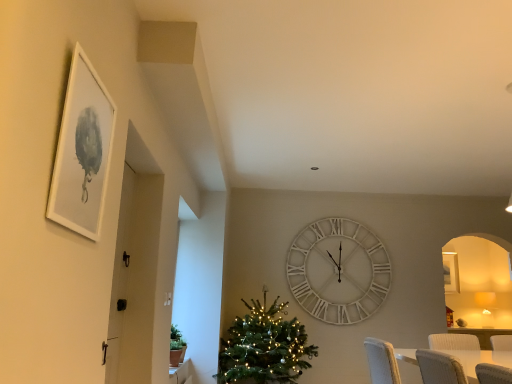
Question: Is green matte christmas tree at center facing away from white matte picture frame at upper left?

Choices:
 (A) yes
 (B) no

Answer: (B)

Question: Is green matte christmas tree at center taller than white matte picture frame at upper left?

Choices:
 (A) yes
 (B) no

Answer: (A)

Question: From a real-world perspective, is green matte christmas tree at center located beneath white matte picture frame at upper left?

Choices:
 (A) no
 (B) yes

Answer: (B)

Question: From a real-world perspective, does green matte christmas tree at center stand above white matte picture frame at upper left?

Choices:
 (A) yes
 (B) no

Answer: (B)

Question: Can we say green matte christmas tree at center lies outside white matte picture frame at upper left?

Choices:
 (A) no
 (B) yes

Answer: (B)

Question: From the image's perspective, is green matte christmas tree at center under white matte picture frame at upper left?

Choices:
 (A) no
 (B) yes

Answer: (B)

Question: Is white matte picture frame at upper left closer to camera compared to white wooden clock at center?

Choices:
 (A) yes
 (B) no

Answer: (A)

Question: Considering the relative sizes of white matte picture frame at upper left and white wooden clock at center in the image provided, is white matte picture frame at upper left wider than white wooden clock at center?

Choices:
 (A) no
 (B) yes

Answer: (A)

Question: Is white matte picture frame at upper left in contact with white wooden clock at center?

Choices:
 (A) no
 (B) yes

Answer: (A)

Question: Is white matte picture frame at upper left outside white wooden clock at center?

Choices:
 (A) no
 (B) yes

Answer: (B)

Question: Is there a large distance between white matte picture frame at upper left and white wooden clock at center?

Choices:
 (A) yes
 (B) no

Answer: (A)

Question: Considering the relative positions of white matte picture frame at upper left and white wooden clock at center in the image provided, is white matte picture frame at upper left to the right of white wooden clock at center from the viewer's perspective?

Choices:
 (A) no
 (B) yes

Answer: (A)

Question: Is white matte picture frame at upper left at the left side of green matte christmas tree at center?

Choices:
 (A) yes
 (B) no

Answer: (A)